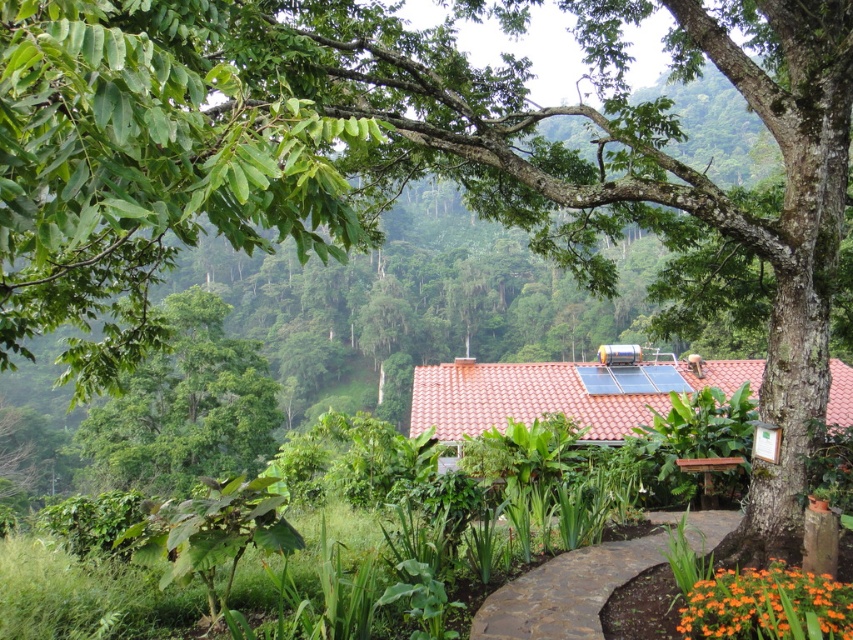
You are a gardener who wants to place a new plant between the orange matte flower at lower right and the brown wooden bench at lower right. Which object should the new plant be closer to if it needs to be placed at the same height as the orange matte flower?

The new plant should be placed closer to the orange matte flower at lower right because it is shorter than the brown wooden bench at lower right.

Looking at this image, you are a gardener planning to place a new plant pot between the orange matte flower at lower right and the brown wooden bench at lower right. Which object should the pot be closer to if you want it to be near the wider one?

The orange matte flower at lower right might be wider than brown wooden bench at lower right, so the pot should be placed closer to the orange matte flower at lower right.